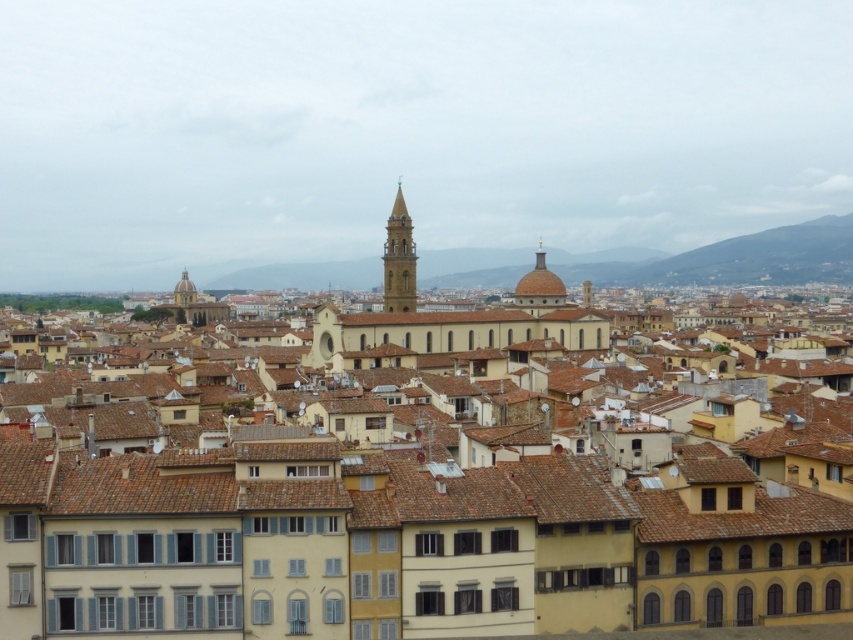
Question: Which point is farther to the camera?

Choices:
 (A) (78, 548)
 (B) (175, 300)
 (C) (540, 285)

Answer: (B)

Question: Is light brown stone tower at center positioned before matte gold dome at upper left?

Choices:
 (A) yes
 (B) no

Answer: (A)

Question: Can you confirm if golden dome at center is smaller than matte gold dome at upper left?

Choices:
 (A) no
 (B) yes

Answer: (A)

Question: Which point is farther to the camera?

Choices:
 (A) yellow matte building at center
 (B) light brown stone tower at center
 (C) golden dome at center

Answer: (B)

Question: Which object is farther from the camera taking this photo?

Choices:
 (A) light brown stone tower at center
 (B) golden dome at center

Answer: (A)

Question: Does yellow matte building at center have a smaller size compared to golden dome at center?

Choices:
 (A) yes
 (B) no

Answer: (A)